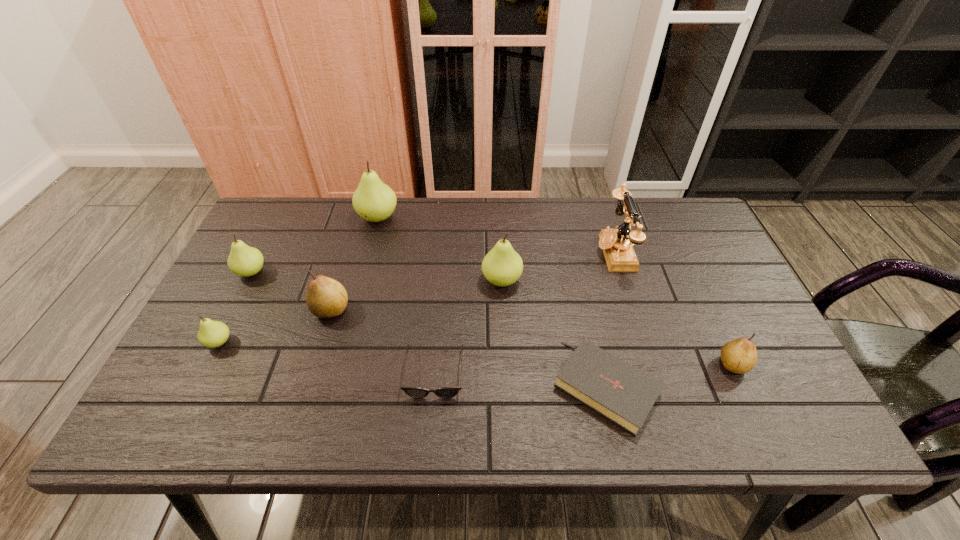
Find the location of a particular element. the closest green pear relative to the third biggest green pear is located at coordinates (212, 334).

Select which green pear is the closest to the biggest green pear. Please provide its 2D coordinates. Your answer should be formatted as a tuple, i.e. [(x, y)], where the tuple contains the x and y coordinates of a point satisfying the conditions above.

[(245, 261)]

Locate an element on the screen. The image size is (960, 540). vacant space that satisfies the following two spatial constraints: 1. on the dial of the beige telephone; 2. on the front lenses of the fifth object from right to left is located at coordinates (652, 372).